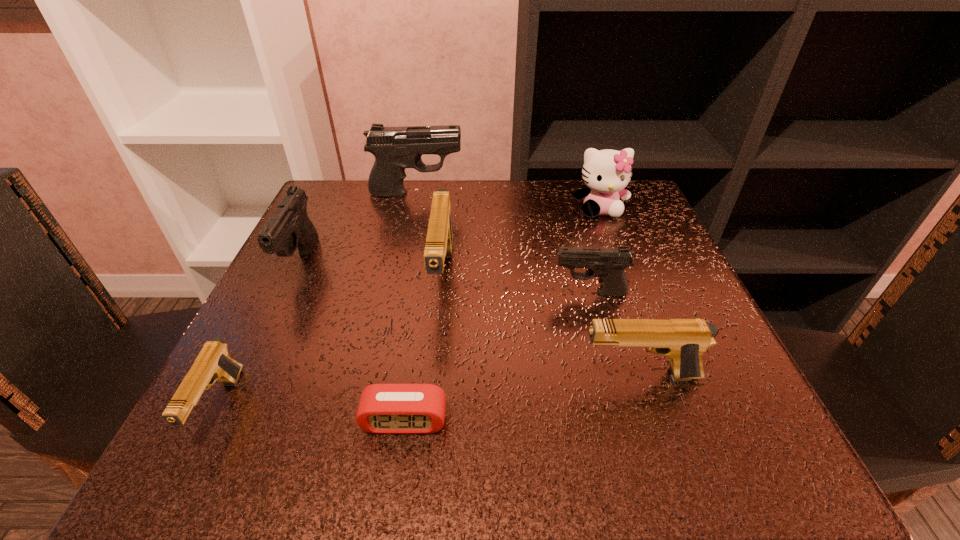
The width and height of the screenshot is (960, 540). In the image, there is a desktop. Find the location of `blank space at the near edge`. blank space at the near edge is located at coordinates (430, 438).

Where is `vacant space at the left edge of the desktop`? Image resolution: width=960 pixels, height=540 pixels. vacant space at the left edge of the desktop is located at coordinates (295, 369).

Find the location of `vacant region at the right edge of the desktop`. vacant region at the right edge of the desktop is located at coordinates coord(637,259).

Find the location of a particular element. This screenshot has width=960, height=540. free region at the far right corner is located at coordinates (638, 218).

Identify the location of free spot between the rightmost black pistol and the leftmost tan pistol. The height and width of the screenshot is (540, 960). (405, 350).

The image size is (960, 540). I want to click on free area in between the second biggest tan pistol and the alarm clock, so click(x=522, y=398).

At what (x,y) coordinates should I click in order to perform the action: click on unoccupied position between the farthest tan pistol and the second biggest tan pistol. Please return your answer as a coordinate pair (x, y). Image resolution: width=960 pixels, height=540 pixels. Looking at the image, I should click on (541, 327).

Where is `free space between the leftmost black pistol and the farthest object`? Image resolution: width=960 pixels, height=540 pixels. free space between the leftmost black pistol and the farthest object is located at coordinates coord(359,228).

Identify the location of vacant space that's between the smallest tan pistol and the smallest black pistol. The width and height of the screenshot is (960, 540). (405, 350).

Find the location of a particular element. This screenshot has width=960, height=540. free space between the second biggest black pistol and the shortest pistol is located at coordinates (260, 335).